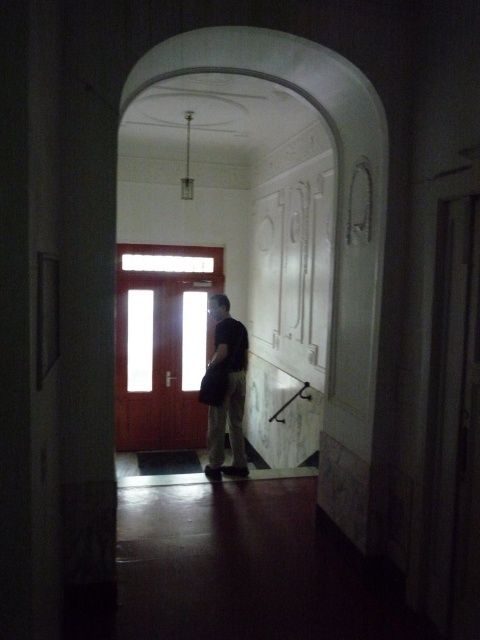
You are standing at the entrance of the hallway and see the wooden door at center and the dark gray fabric bag at center. Which object is taller?

The wooden door at center is taller than the dark gray fabric bag at center.

You are standing at the entrance of the hallway and see the wooden door at center and the dark gray fabric bag at center. Which object is positioned to the left side of the other?

The wooden door at center is to the left of dark gray fabric bag at center.

You are standing in the hallway and see the wooden door at center and the dark gray fabric bag at center. Which object is closer to you?

The wooden door at center is closer to you than the dark gray fabric bag at center.